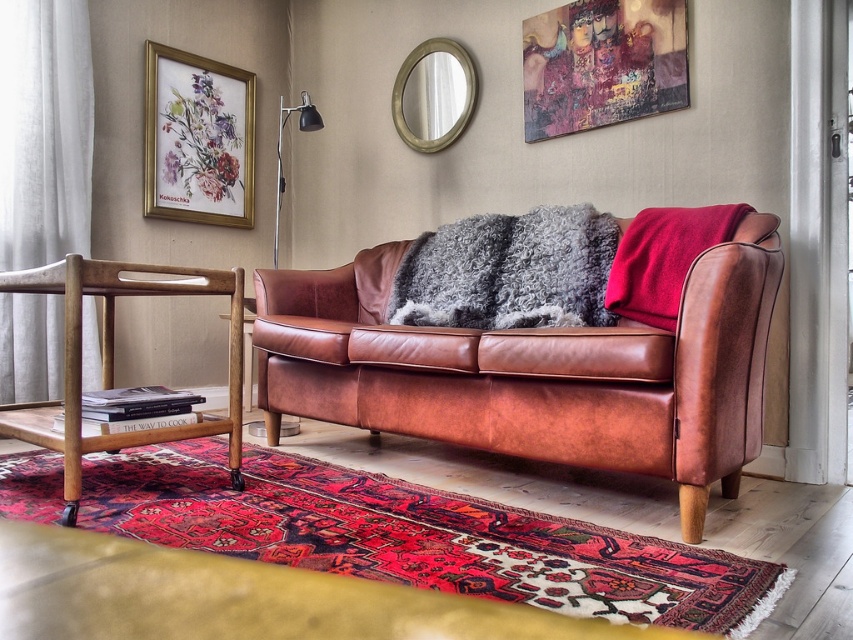
You are standing in the living room and want to place a small plant between the two points, point 1 at (x=627, y=332) and point 2 at (x=473, y=104). Which point should the plant be closer to if you want it to be closer to the sofa?

The plant should be closer to point 1 at (x=627, y=332) because it is in front of point 2 at (x=473, y=104), meaning it is closer to the sofa.